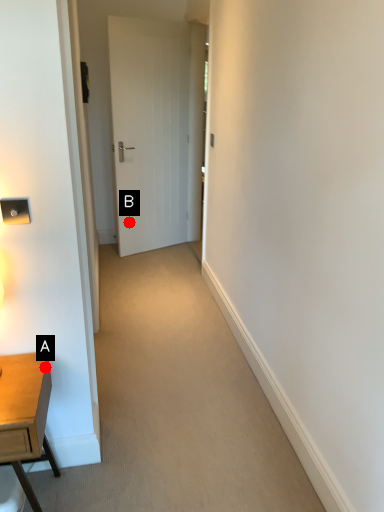
Question: Two points are circled on the image, labeled by A and B beside each circle. Which point is farther from the camera taking this photo?

Choices:
 (A) A is further
 (B) B is further

Answer: (B)